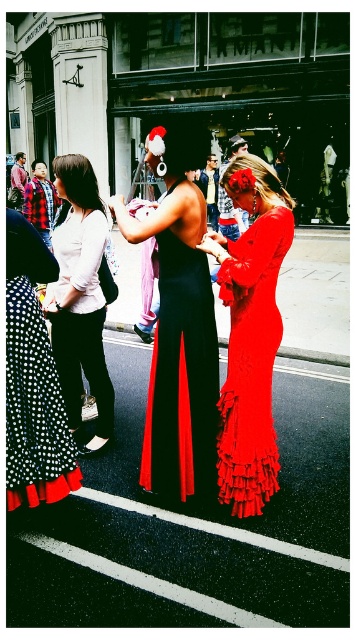
Does matte black dress at center have a greater width compared to white matte blouse at left?

Yes.

Is point (119, 221) positioned in front of point (70, 241)?

Yes, point (119, 221) is in front of point (70, 241).

This screenshot has height=640, width=356. Find the location of `matte black dress at center`. matte black dress at center is located at coordinates (179, 323).

Does white matte blouse at left have a greater width compared to black polka dot fabric dress at lower left?

Yes.

Which of these two, white matte blouse at left or black polka dot fabric dress at lower left, stands taller?

white matte blouse at left

Is point (71, 275) closer to viewer compared to point (16, 484)?

No, it is behind (16, 484).

This screenshot has height=640, width=356. Find the location of `white matte blouse at left`. white matte blouse at left is located at coordinates (80, 296).

Is matte black dress at center to the left of silky red dress at center from the viewer's perspective?

Correct, you'll find matte black dress at center to the left of silky red dress at center.

Is point (196, 332) closer to viewer compared to point (275, 314)?

Yes, it is.

Find the location of `matte black dress at center`. matte black dress at center is located at coordinates (179, 323).